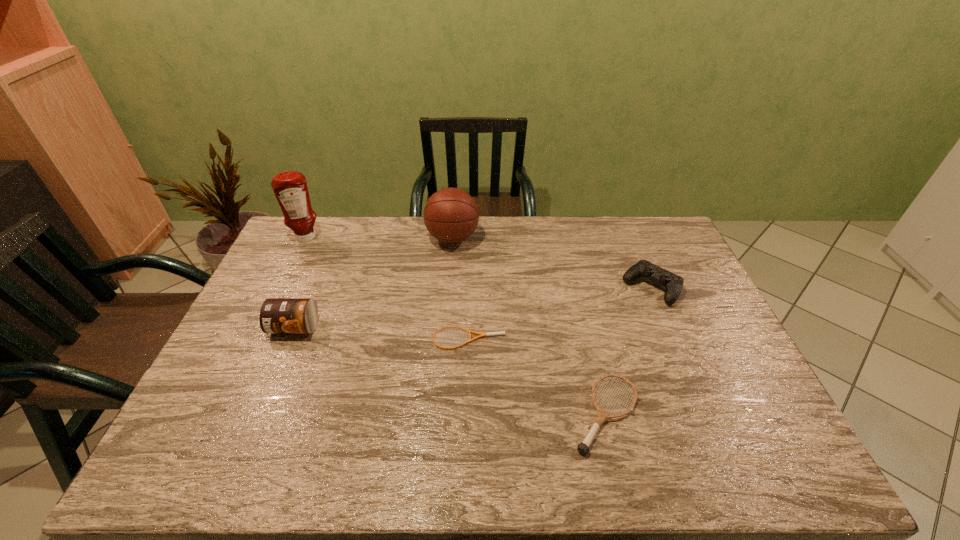
Where is `object that is at the right edge`? Image resolution: width=960 pixels, height=540 pixels. object that is at the right edge is located at coordinates (673, 283).

Where is `object located at the far left corner`? object located at the far left corner is located at coordinates (290, 188).

Identify the location of blank space at the far edge of the desktop. (526, 228).

At what (x,y) coordinates should I click in order to perform the action: click on free space at the near edge of the desktop. Please return your answer as a coordinate pair (x, y). Looking at the image, I should click on (238, 468).

The height and width of the screenshot is (540, 960). Identify the location of vacant space at the left edge. (204, 428).

Locate an element on the screen. Image resolution: width=960 pixels, height=540 pixels. free space at the right edge is located at coordinates (725, 330).

Locate an element on the screen. vacant point at the far left corner is located at coordinates (x=316, y=238).

Find the location of a particular element. free space at the far right corner of the desktop is located at coordinates (667, 250).

What are the coordinates of `free space between the can and the second shortest object` in the screenshot? It's located at (450, 370).

You are a GUI agent. You are given a task and a screenshot of the screen. Output one action in this format:
    pyautogui.click(x=<x>, y=<y>)
    Task: Click on the free space between the fourth shortest object and the fifth tallest object
    The width and height of the screenshot is (960, 540).
    Given the screenshot: What is the action you would take?
    pyautogui.click(x=450, y=370)